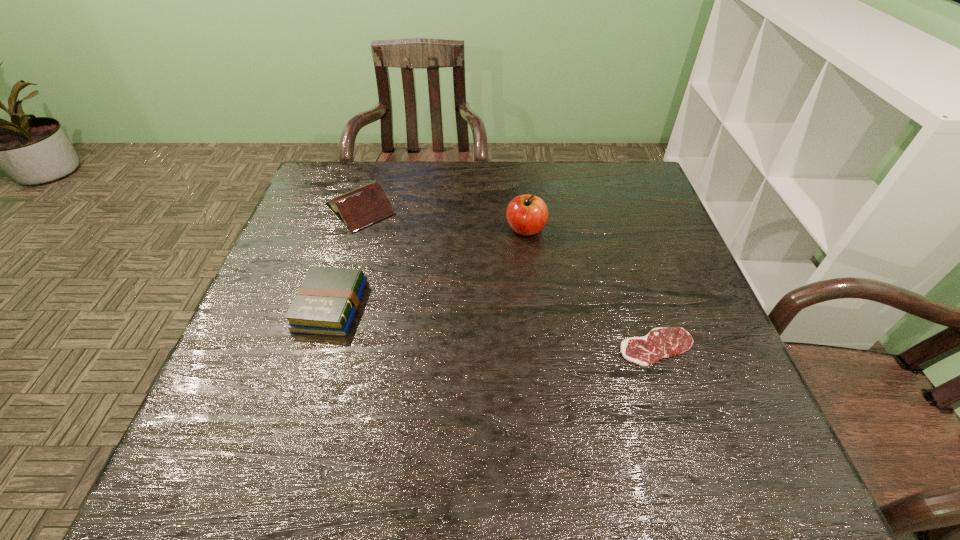
In the image, there is a desktop. Identify the location of vacant space at the far right corner. This screenshot has height=540, width=960. (640, 165).

In the image, there is a desktop. Where is `vacant region at the near right corner`? The width and height of the screenshot is (960, 540). vacant region at the near right corner is located at coordinates (711, 465).

Locate an element on the screen. unoccupied area between the shortest object and the second shortest object is located at coordinates (493, 327).

Identify the location of empty space that is in between the third tallest object and the farther book. (345, 257).

The image size is (960, 540). I want to click on free space between the steak and the farther book, so click(508, 278).

You are a GUI agent. You are given a task and a screenshot of the screen. Output one action in this format:
    pyautogui.click(x=<x>, y=<y>)
    Task: Click on the vacant space in between the tallest object and the rightmost object
    
    Given the screenshot: What is the action you would take?
    (x=591, y=288)

Image resolution: width=960 pixels, height=540 pixels. In order to click on free point between the taller book and the third tallest object in this screenshot , I will do `click(345, 257)`.

Find the location of a particular element. free space that is in between the steak and the nearer book is located at coordinates (493, 327).

I want to click on empty space between the shorter book and the second tallest object, so click(x=345, y=257).

This screenshot has height=540, width=960. I want to click on vacant area that lies between the farther book and the steak, so pos(508,278).